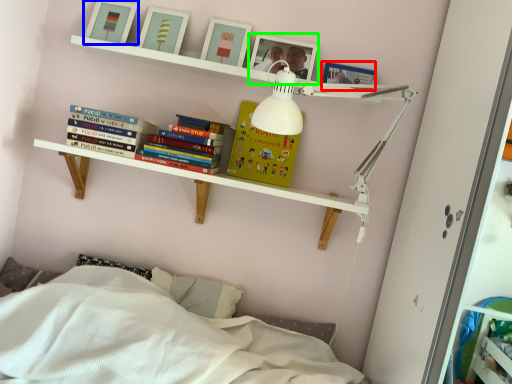
Question: Based on their relative distances, which object is nearer to picture frame (highlighted by a red box)? Choose from picture frame (highlighted by a blue box) and picture frame (highlighted by a green box).

Choices:
 (A) picture frame
 (B) picture frame

Answer: (B)